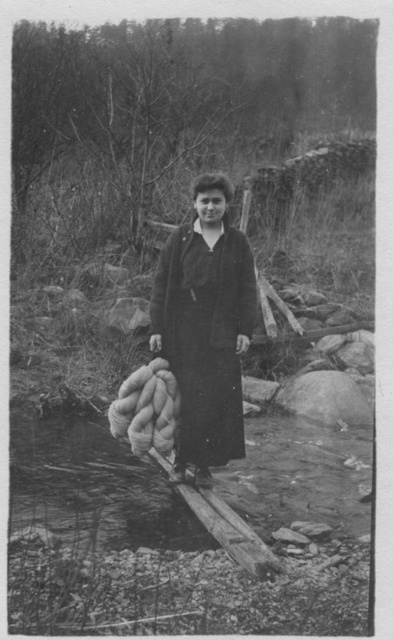
You are a hiker carrying a heavy backpack and need to cross the wooden bridge in the image. The smooth stone stream at center and dark wool coat at center are 4.68 feet apart. Can you safely step between them while carrying your load?

The smooth stone stream at center and dark wool coat at center are 4.68 feet apart. Since the distance between them is sufficient for a hiker to step through while carrying a backpack, it is safe to proceed.

You are a photographer standing at the edge of the smooth stone stream at center. You want to capture a wide shot of the entire scene. Given that your camera has a 50mm lens, which has a field of view of approximately 46 degrees, can you estimate if the entire scene will fit in your frame without moving the camera?

The smooth stone stream at center is 4.52 meters from the camera. Using the formula for field of view, the maximum distance for the 50mm lens to capture the entire scene would require the width of the stream to be within the lens field of view. However, without knowing the exact width of the stream, it is impossible to definitively determine if the entire scene will fit. The photographer might need to adjust their position or use a wider lens for a better composition.